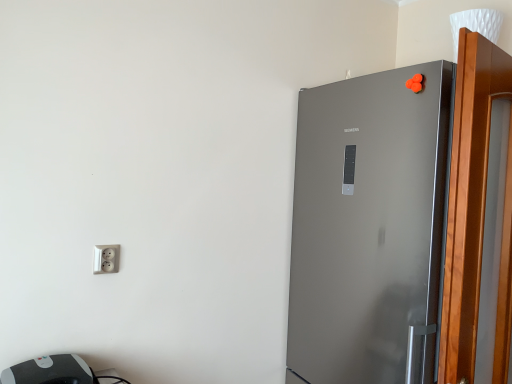
Question: Is gray plastic printer at lower left in front of or behind wooden screen door at right in the image?

Choices:
 (A) behind
 (B) front

Answer: (A)

Question: Is gray plastic printer at lower left taller or shorter than wooden screen door at right?

Choices:
 (A) short
 (B) tall

Answer: (A)

Question: Based on their relative distances, which object is nearer to the gray plastic printer at lower left?

Choices:
 (A) silver metallic socket at lower left
 (B) wooden screen door at right
 (C) satin silver refrigerator at right

Answer: (A)

Question: Estimate the real-world distances between objects in this image. Which object is closer to the wooden screen door at right?

Choices:
 (A) gray plastic printer at lower left
 (B) silver metallic socket at lower left
 (C) satin silver refrigerator at right

Answer: (C)